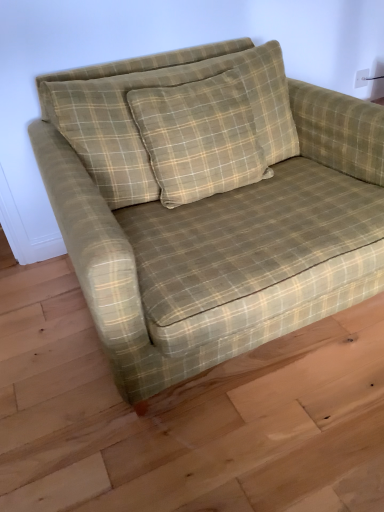
Question: Is green plaid fabric couch at center closer to camera compared to white plastic electric outlet at upper right?

Choices:
 (A) yes
 (B) no

Answer: (A)

Question: Would you say green plaid fabric couch at center is a long distance from white plastic electric outlet at upper right?

Choices:
 (A) yes
 (B) no

Answer: (A)

Question: Does green plaid fabric couch at center have a greater width compared to white plastic electric outlet at upper right?

Choices:
 (A) yes
 (B) no

Answer: (A)

Question: Can you confirm if green plaid fabric couch at center is bigger than white plastic electric outlet at upper right?

Choices:
 (A) yes
 (B) no

Answer: (A)

Question: Is white plastic electric outlet at upper right at the back of green plaid fabric couch at center?

Choices:
 (A) no
 (B) yes

Answer: (A)

Question: From the image's perspective, is green plaid fabric couch at center located above or below white plastic electric outlet at upper right?

Choices:
 (A) below
 (B) above

Answer: (A)

Question: Is green plaid fabric couch at center in front of or behind white plastic electric outlet at upper right in the image?

Choices:
 (A) front
 (B) behind

Answer: (A)

Question: From their relative heights in the image, would you say green plaid fabric couch at center is taller or shorter than white plastic electric outlet at upper right?

Choices:
 (A) short
 (B) tall

Answer: (B)

Question: Visually, is green plaid fabric couch at center positioned to the left or to the right of white plastic electric outlet at upper right?

Choices:
 (A) left
 (B) right

Answer: (A)

Question: Is white plastic electric outlet at upper right situated inside green plaid pillow at center or outside?

Choices:
 (A) inside
 (B) outside

Answer: (B)

Question: From a real-world perspective, is white plastic electric outlet at upper right positioned above or below green plaid pillow at center?

Choices:
 (A) above
 (B) below

Answer: (B)

Question: Is point (357, 71) closer or farther from the camera than point (94, 159)?

Choices:
 (A) farther
 (B) closer

Answer: (A)

Question: Considering the positions of white plastic electric outlet at upper right and green plaid pillow at center in the image, is white plastic electric outlet at upper right wider or thinner than green plaid pillow at center?

Choices:
 (A) wide
 (B) thin

Answer: (B)

Question: In the image, is green plaid fabric couch at center positioned in front of or behind green plaid pillow at center?

Choices:
 (A) behind
 (B) front

Answer: (B)

Question: From the image's perspective, is green plaid fabric couch at center above or below green plaid pillow at center?

Choices:
 (A) above
 (B) below

Answer: (B)